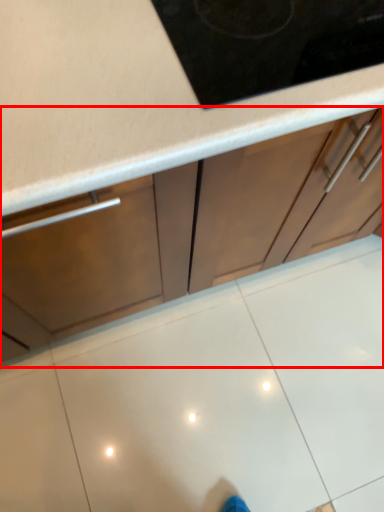
Question: Observing the image, what is the correct spatial positioning of cabinetry (annotated by the red box) in reference to tile?

Choices:
 (A) left
 (B) right

Answer: (A)